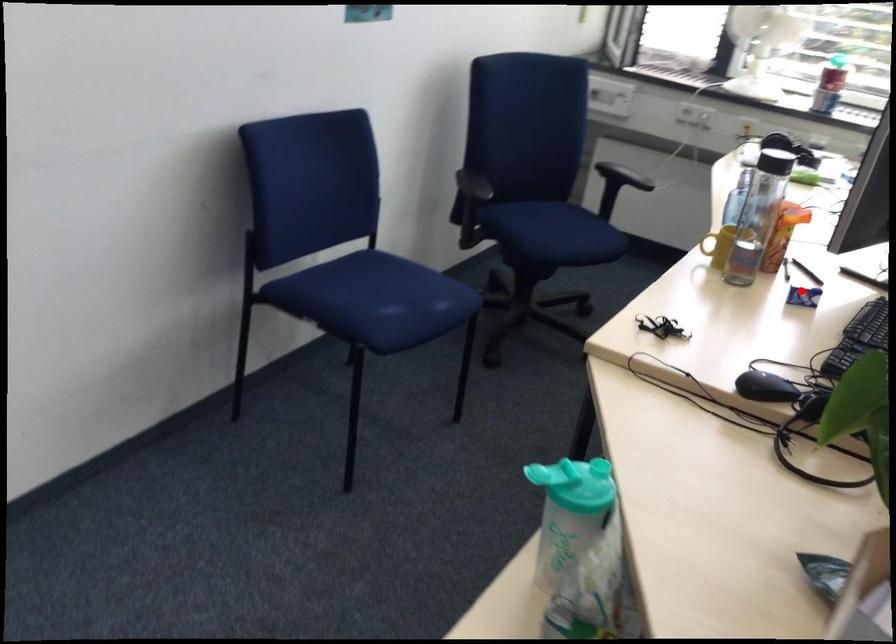
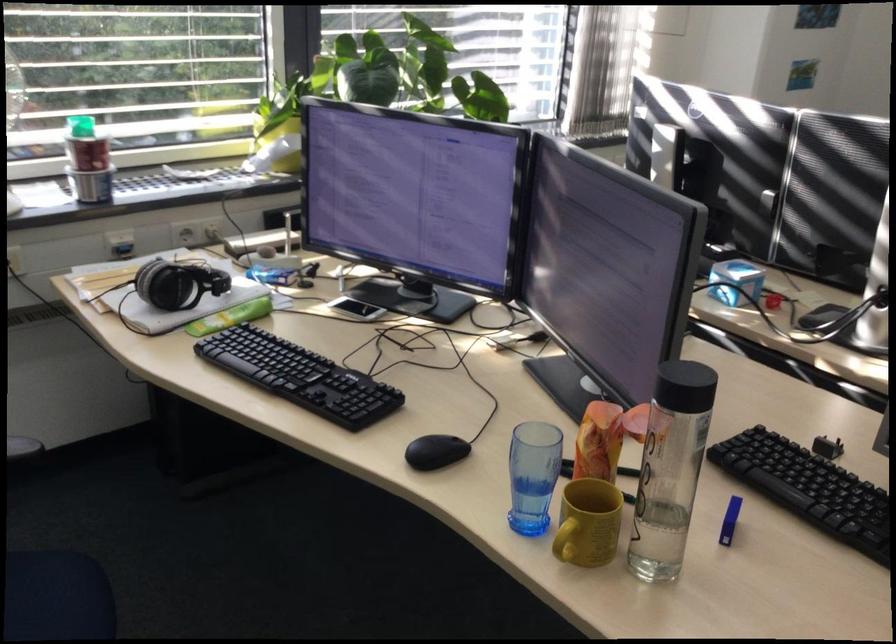
Where in the second image is the point corresponding to the highlighted location from the first image?

(729, 520)